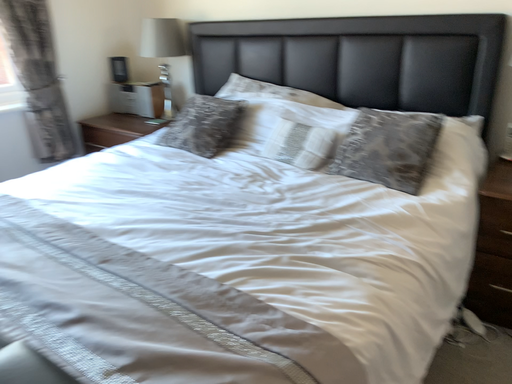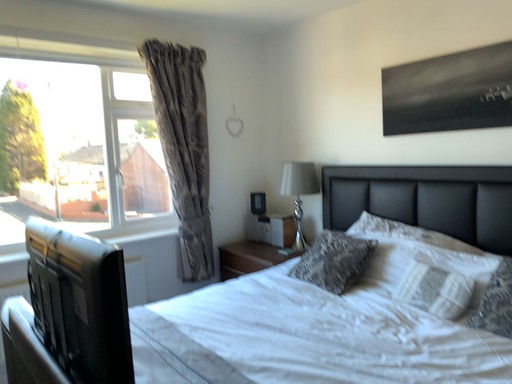
Question: How did the camera likely rotate when shooting the video?

Choices:
 (A) rotated downward
 (B) rotated upward

Answer: (B)